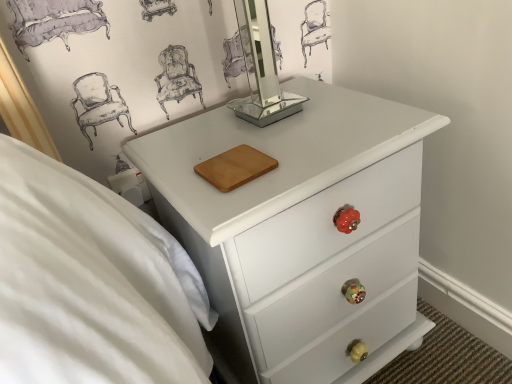
What do you see at coordinates (300, 227) in the screenshot?
I see `white glossy chest of drawers at center` at bounding box center [300, 227].

The width and height of the screenshot is (512, 384). What are the coordinates of `white glossy chest of drawers at center` in the screenshot? It's located at (300, 227).

In order to click on white glossy chest of drawers at center in this screenshot , I will do point(300,227).